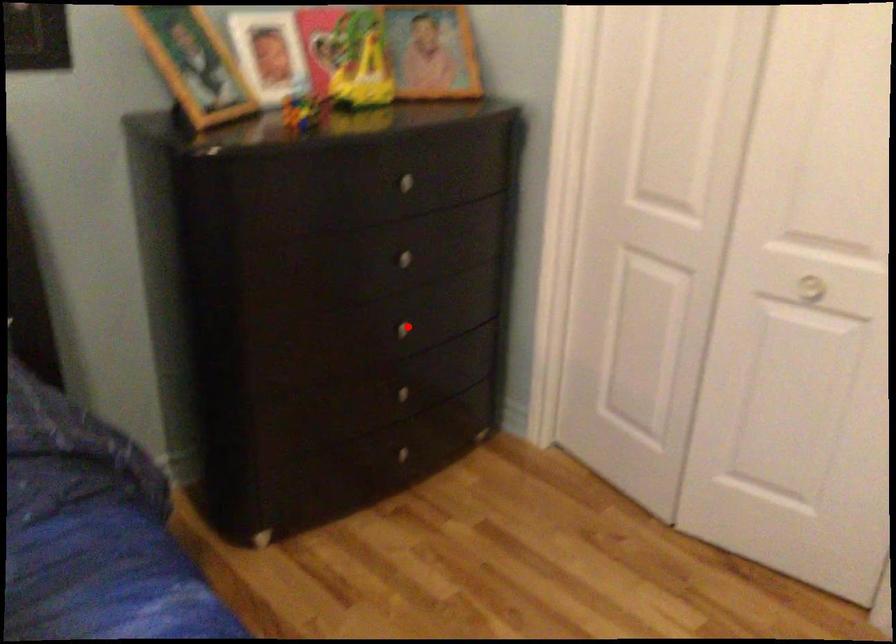
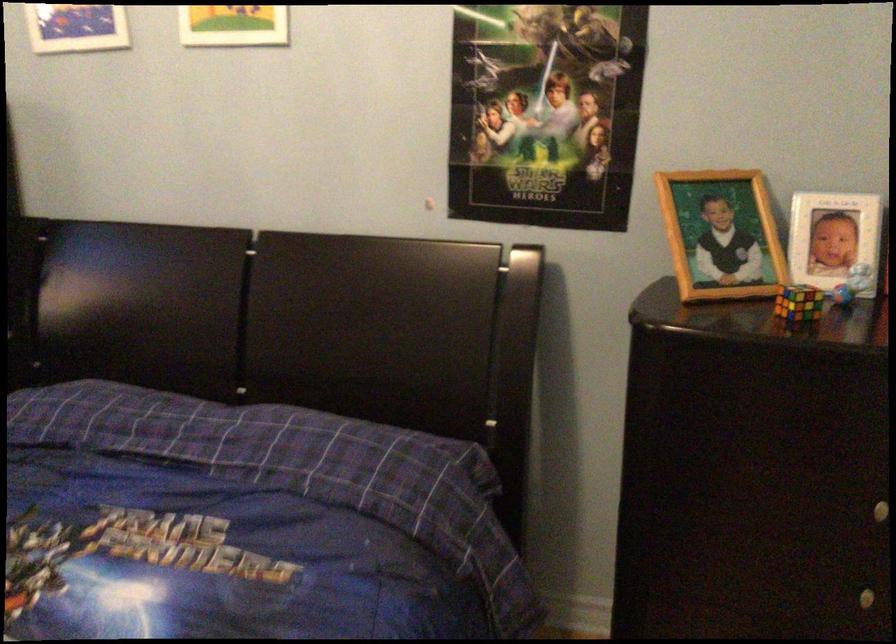
Question: I am providing you with two images of the same scene from different viewpoints. A red point is shown in image1. For the corresponding object point in image2, is it positioned nearer or farther from the camera?

Choices:
 (A) Nearer
 (B) Farther

Answer: (A)